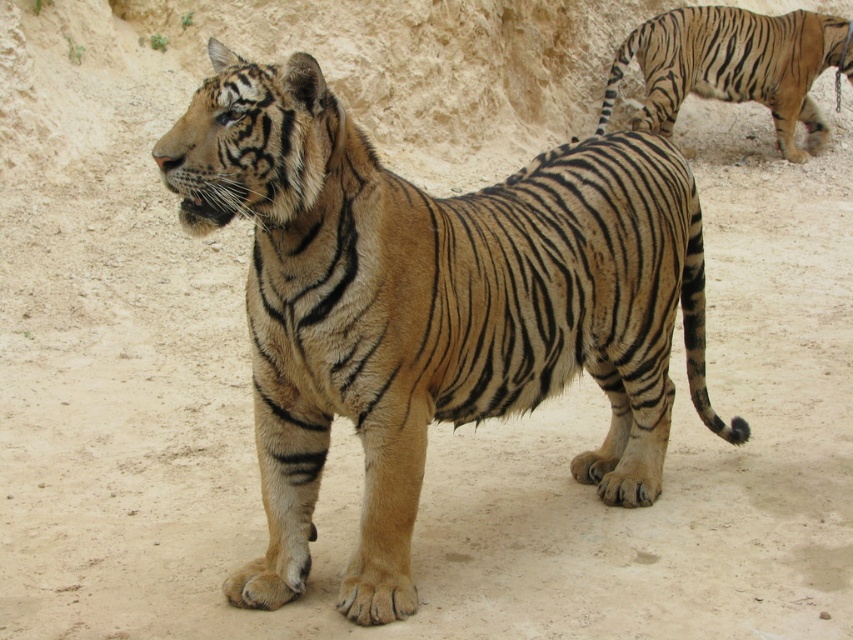
Question: Does golden fur tiger at center appear on the right side of striped fur tiger at upper right?

Choices:
 (A) no
 (B) yes

Answer: (A)

Question: Which object appears farthest from the camera in this image?

Choices:
 (A) striped fur tiger at upper right
 (B) golden fur tiger at center

Answer: (A)

Question: Which object appears closest to the camera in this image?

Choices:
 (A) golden fur tiger at center
 (B) striped fur tiger at upper right

Answer: (A)

Question: Which object appears closest to the camera in this image?

Choices:
 (A) golden fur tiger at center
 (B) striped fur tiger at upper right

Answer: (A)

Question: Can you confirm if golden fur tiger at center is thinner than striped fur tiger at upper right?

Choices:
 (A) no
 (B) yes

Answer: (B)

Question: Is golden fur tiger at center positioned behind striped fur tiger at upper right?

Choices:
 (A) yes
 (B) no

Answer: (B)